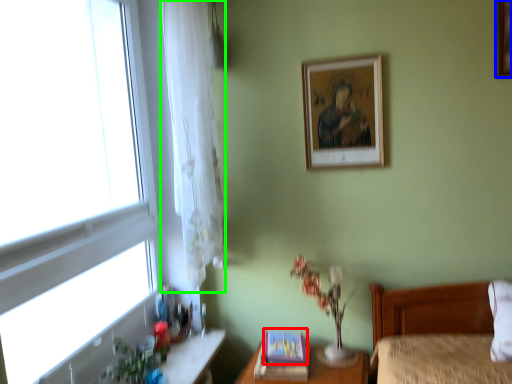
Question: Based on their relative distances, which object is farther from picture frame (highlighted by a red box)? Choose from picture frame (highlighted by a blue box) and curtain (highlighted by a green box).

Choices:
 (A) picture frame
 (B) curtain

Answer: (A)